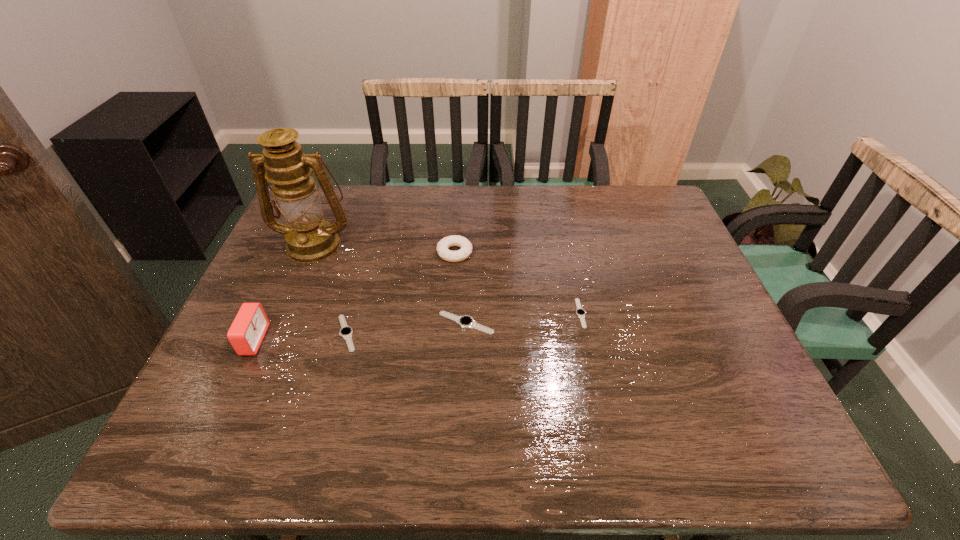
The width and height of the screenshot is (960, 540). Identify the location of vacant space situated 0.300m on the left of the third shortest object. (318, 323).

Image resolution: width=960 pixels, height=540 pixels. I want to click on vacant space located on the right of the shortest watch, so click(634, 313).

In order to click on free location located on the back of the doughnut in this screenshot , I will do `click(459, 188)`.

Locate an element on the screen. The image size is (960, 540). vacant space situated on the right of the oil lamp is located at coordinates (465, 244).

Find the location of a particular element. The width and height of the screenshot is (960, 540). vacant region located 0.290m on the front-facing side of the alarm clock is located at coordinates (385, 340).

Image resolution: width=960 pixels, height=540 pixels. What are the coordinates of `object at the far edge` in the screenshot? It's located at (309, 238).

Image resolution: width=960 pixels, height=540 pixels. What are the coordinates of `oil lamp positioned at the left edge` in the screenshot? It's located at (309, 238).

Identify the location of alarm clock that is at the left edge. The width and height of the screenshot is (960, 540). (248, 329).

This screenshot has width=960, height=540. I want to click on object that is at the far left corner, so click(x=309, y=238).

At what (x,y) coordinates should I click in order to perform the action: click on free point at the far edge. Please return your answer as a coordinate pair (x, y). This screenshot has height=540, width=960. Looking at the image, I should click on (522, 227).